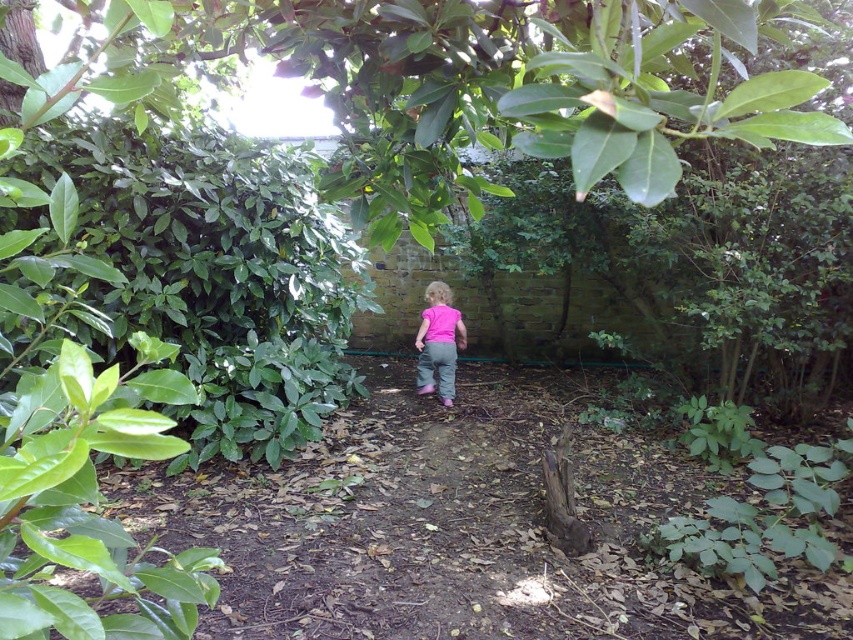
Who is more distant from viewer, (427, 232) or (430, 376)?

A: The point (430, 376) is more distant.

Describe the element at coordinates (506, 83) in the screenshot. The width and height of the screenshot is (853, 640). I see `green leafy tree at upper center` at that location.

The image size is (853, 640). In order to click on green leafy tree at upper center in this screenshot , I will do `click(506, 83)`.